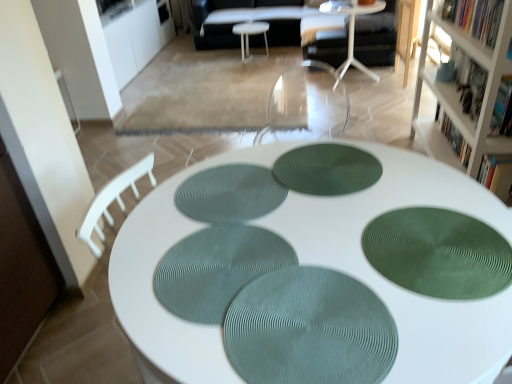
Question: Is green textured placemat at center, the 2th mat viewed from the right, touching white plastic table at center, which ranks as the 2th table in front-to-back order?

Choices:
 (A) no
 (B) yes

Answer: (A)

Question: Is green textured placemat at center, the 2th mat viewed from the right, facing away from white plastic table at center, the 2th table viewed from the back?

Choices:
 (A) yes
 (B) no

Answer: (B)

Question: Considering the relative sizes of green textured placemat at center, marked as the 3th mat in a left-to-right arrangement, and white plastic table at center, which ranks as the 2th table in front-to-back order, in the image provided, is green textured placemat at center, marked as the 3th mat in a left-to-right arrangement, shorter than white plastic table at center, which ranks as the 2th table in front-to-back order,?

Choices:
 (A) yes
 (B) no

Answer: (A)

Question: Considering the relative positions of green textured placemat at center, marked as the 3th mat in a left-to-right arrangement, and white plastic table at center, which ranks as the 2th table in front-to-back order, in the image provided, is green textured placemat at center, marked as the 3th mat in a left-to-right arrangement, to the left of white plastic table at center, which ranks as the 2th table in front-to-back order, from the viewer's perspective?

Choices:
 (A) yes
 (B) no

Answer: (A)

Question: Does green textured placemat at center, the 2th mat viewed from the right, have a larger size compared to white plastic table at center, the second table ordered from the bottom?

Choices:
 (A) no
 (B) yes

Answer: (A)

Question: Is green textured placemat at center, marked as the 3th mat in a left-to-right arrangement, further to camera compared to white plastic table at center, which ranks as the 2th table in front-to-back order?

Choices:
 (A) yes
 (B) no

Answer: (B)

Question: Is hardcover book at upper right, placed as the 1th book when sorted from back to front, to the left of hardcover book at upper right, which is the 3th book in back-to-front order, from the viewer's perspective?

Choices:
 (A) yes
 (B) no

Answer: (B)

Question: Is hardcover book at upper right, arranged as the third book when viewed from the front, wider than hardcover book at upper right, which is the 3th book in back-to-front order?

Choices:
 (A) yes
 (B) no

Answer: (B)

Question: Does hardcover book at upper right, placed as the 1th book when sorted from back to front, have a smaller size compared to hardcover book at upper right, which is the 3th book in back-to-front order?

Choices:
 (A) yes
 (B) no

Answer: (B)

Question: Is hardcover book at upper right, arranged as the third book when viewed from the front, facing towards hardcover book at upper right, which is the 1th book from front to back?

Choices:
 (A) yes
 (B) no

Answer: (B)

Question: Is hardcover book at upper right, arranged as the third book when viewed from the front, positioned in front of hardcover book at upper right, which is the 1th book from front to back?

Choices:
 (A) no
 (B) yes

Answer: (A)

Question: Does hardcover book at upper right, arranged as the third book when viewed from the front, have a larger size compared to hardcover book at upper right, which is the 1th book from front to back?

Choices:
 (A) no
 (B) yes

Answer: (B)

Question: Does green matte bookshelf at upper right, marked as the second book in a front-to-back arrangement, touch white textured table at center, which is the 1th table from front to back?

Choices:
 (A) no
 (B) yes

Answer: (A)